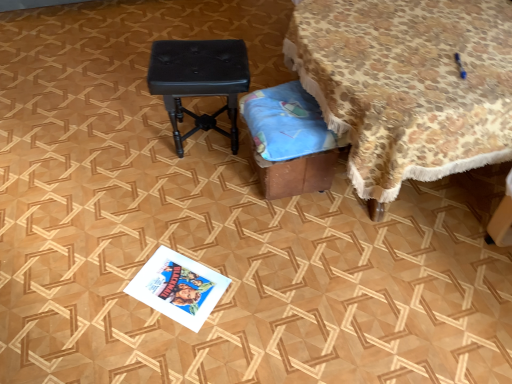
Identify the location of free space that is in between floral fabric-covered table at upper right and white glossy magazine at lower center. This screenshot has width=512, height=384. (267, 244).